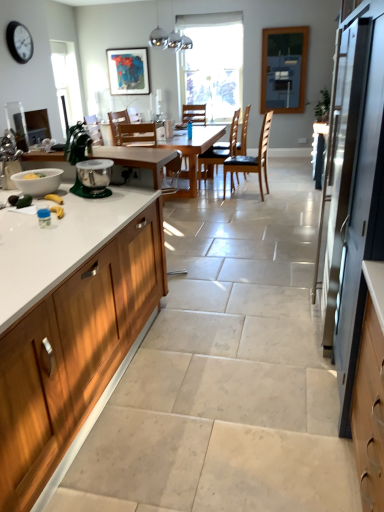
Question: From the image's perspective, does green plastic stand mixer at left appear higher than satin silver refrigerator at right?

Choices:
 (A) no
 (B) yes

Answer: (B)

Question: From the image's perspective, is green plastic stand mixer at left beneath satin silver refrigerator at right?

Choices:
 (A) no
 (B) yes

Answer: (A)

Question: From a real-world perspective, is green plastic stand mixer at left located higher than satin silver refrigerator at right?

Choices:
 (A) yes
 (B) no

Answer: (A)

Question: Is green plastic stand mixer at left with satin silver refrigerator at right?

Choices:
 (A) yes
 (B) no

Answer: (B)

Question: Is green plastic stand mixer at left behind satin silver refrigerator at right?

Choices:
 (A) yes
 (B) no

Answer: (A)

Question: Is black plastic clock at upper left in front of or behind wooden cabinet at left in the image?

Choices:
 (A) behind
 (B) front

Answer: (A)

Question: Is black plastic clock at upper left inside or outside of wooden cabinet at left?

Choices:
 (A) outside
 (B) inside

Answer: (A)

Question: From a real-world perspective, is black plastic clock at upper left positioned above or below wooden cabinet at left?

Choices:
 (A) above
 (B) below

Answer: (A)

Question: Is black plastic clock at upper left wider or thinner than wooden cabinet at left?

Choices:
 (A) thin
 (B) wide

Answer: (A)

Question: Considering the positions of light wood table at center and transparent glass window at center in the image, is light wood table at center bigger or smaller than transparent glass window at center?

Choices:
 (A) big
 (B) small

Answer: (A)

Question: Is light wood table at center inside or outside of transparent glass window at center?

Choices:
 (A) outside
 (B) inside

Answer: (A)

Question: Based on their positions, is light wood table at center located to the left or right of transparent glass window at center?

Choices:
 (A) left
 (B) right

Answer: (A)

Question: From the image's perspective, is light wood table at center positioned above or below transparent glass window at center?

Choices:
 (A) below
 (B) above

Answer: (A)

Question: Considering their positions, is wooden chair at center, which is the first chair in front-to-back order, located in front of or behind wooden chair at center, which ranks as the fourth chair in front-to-back order?

Choices:
 (A) front
 (B) behind

Answer: (A)

Question: Considering the positions of wooden chair at center, which is the first chair in front-to-back order, and wooden chair at center, the second chair in the back-to-front sequence, in the image, is wooden chair at center, which is the first chair in front-to-back order, wider or thinner than wooden chair at center, the second chair in the back-to-front sequence,?

Choices:
 (A) thin
 (B) wide

Answer: (A)